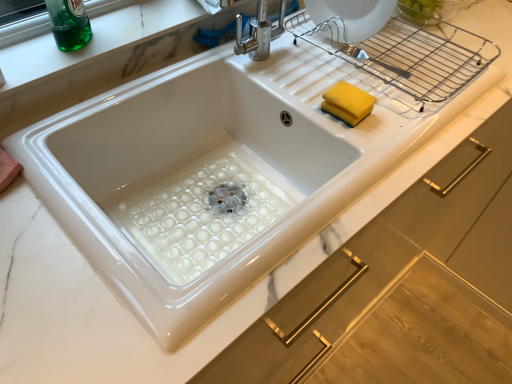
Question: Is yellow sponge at upper right with white glossy sink at center?

Choices:
 (A) no
 (B) yes

Answer: (A)

Question: Does yellow sponge at upper right appear on the left side of white glossy sink at center?

Choices:
 (A) yes
 (B) no

Answer: (B)

Question: Is yellow sponge at upper right looking in the opposite direction of white glossy sink at center?

Choices:
 (A) no
 (B) yes

Answer: (A)

Question: From a real-world perspective, is yellow sponge at upper right on white glossy sink at center?

Choices:
 (A) yes
 (B) no

Answer: (A)

Question: Is yellow sponge at upper right positioned behind white glossy sink at center?

Choices:
 (A) yes
 (B) no

Answer: (A)

Question: In the image, is green glass bottle at upper left on the left side or the right side of white glossy sink at center?

Choices:
 (A) left
 (B) right

Answer: (A)

Question: Looking at their shapes, would you say green glass bottle at upper left is wider or thinner than white glossy sink at center?

Choices:
 (A) wide
 (B) thin

Answer: (B)

Question: From a real-world perspective, is green glass bottle at upper left above or below white glossy sink at center?

Choices:
 (A) above
 (B) below

Answer: (A)

Question: From the image's perspective, relative to white glossy sink at center, is green glass bottle at upper left above or below?

Choices:
 (A) above
 (B) below

Answer: (A)

Question: From a real-world perspective, is white glossy sink at center physically located above or below yellow sponge at upper right?

Choices:
 (A) above
 (B) below

Answer: (B)

Question: Is white glossy sink at center inside the boundaries of yellow sponge at upper right, or outside?

Choices:
 (A) inside
 (B) outside

Answer: (B)

Question: Would you say white glossy sink at center is to the left or to the right of yellow sponge at upper right in the picture?

Choices:
 (A) left
 (B) right

Answer: (A)

Question: Does point (342, 160) appear closer or farther from the camera than point (357, 92)?

Choices:
 (A) farther
 (B) closer

Answer: (B)

Question: Based on their positions, is yellow sponge at upper right located to the left or right of white glossy sink at center?

Choices:
 (A) left
 (B) right

Answer: (B)

Question: From the image's perspective, is yellow sponge at upper right positioned above or below white glossy sink at center?

Choices:
 (A) above
 (B) below

Answer: (A)